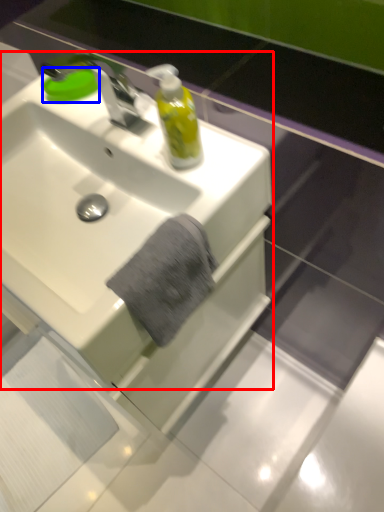
Question: Among these objects, which one is nearest to the camera, sink (highlighted by a red box) or soap (highlighted by a blue box)?

Choices:
 (A) sink
 (B) soap

Answer: (A)